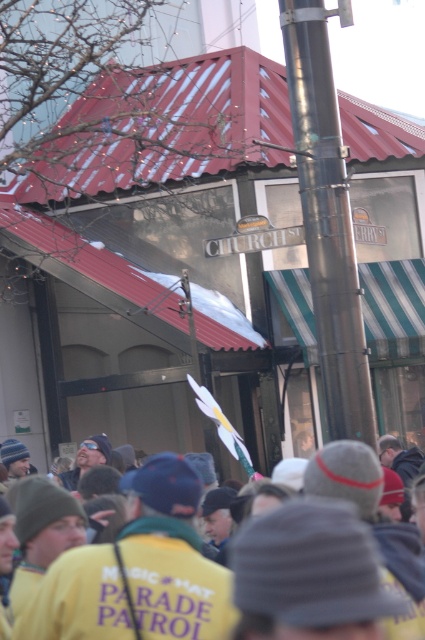
You are a photographer trying to capture the yellow fabric at center and the polished metal pole at center in a single shot. Which object should you adjust your camera to focus on first if you want to include both in your frame?

The yellow fabric at center is positioned on the left side of polished metal pole at center, so you should focus on the polished metal pole at center first to ensure both objects are within the frame.